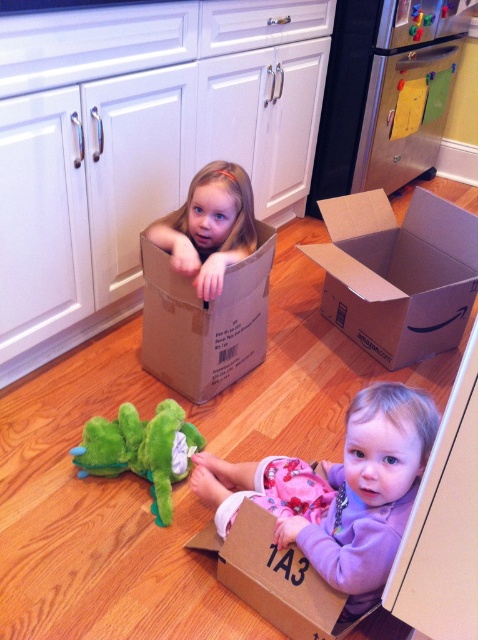
Can you confirm if purple soft toddler at lower center is positioned below brown cardboard box at center?

Indeed, purple soft toddler at lower center is positioned under brown cardboard box at center.

Describe the element at coordinates (337, 492) in the screenshot. This screenshot has height=640, width=478. I see `purple soft toddler at lower center` at that location.

Does point (404, 461) come behind point (213, 326)?

No, it is in front of (213, 326).

You are a GUI agent. You are given a task and a screenshot of the screen. Output one action in this format:
    pyautogui.click(x=<x>, y=<y>)
    Task: Click on the purple soft toddler at lower center
    This screenshot has height=640, width=478.
    Given the screenshot: What is the action you would take?
    (337, 492)

Does purple soft toddler at lower center have a smaller size compared to light brown cardboard box at upper center?

Incorrect, purple soft toddler at lower center is not smaller in size than light brown cardboard box at upper center.

Looking at this image, between purple soft toddler at lower center and light brown cardboard box at upper center, which one has more height?

purple soft toddler at lower center is taller.

Does point (399, 481) come behind point (206, 198)?

No, it is in front of (206, 198).

The image size is (478, 640). Find the location of `purple soft toddler at lower center`. purple soft toddler at lower center is located at coordinates (337, 492).

I want to click on purple soft toddler at lower center, so click(337, 492).

Does point (421, 406) come farther from viewer compared to point (129, 451)?

No, (421, 406) is closer to viewer.

Does point (326, 566) lie behind point (171, 397)?

No, it is in front of (171, 397).

The image size is (478, 640). Find the location of `purple soft toddler at lower center`. purple soft toddler at lower center is located at coordinates (337, 492).